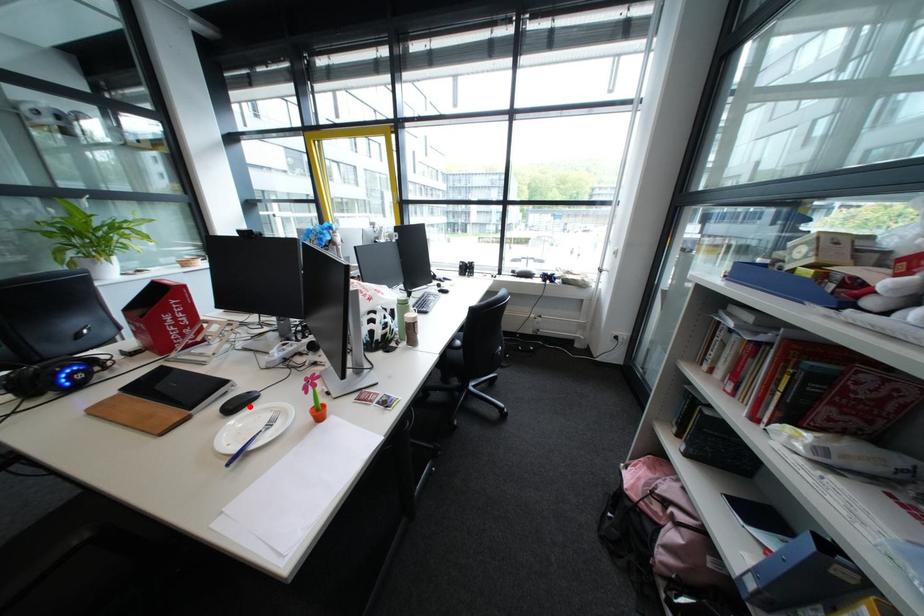
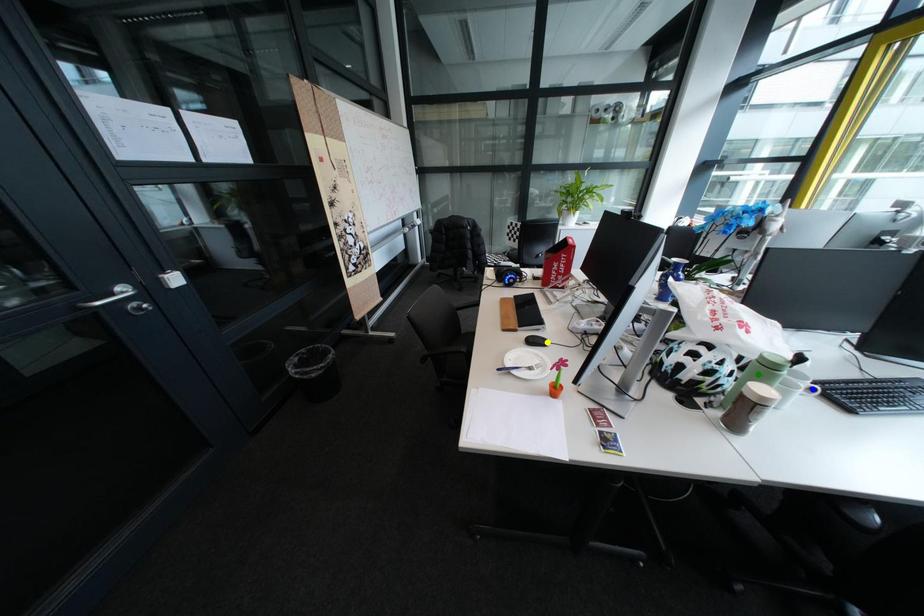
Question: I am providing you with two images of the same scene from different viewpoints. A red point is marked on the first image. You are given multiple points on the second image. Can you choose the point in image 2 that corresponds to the point in image 1?

Choices:
 (A) blue point
 (B) green point
 (C) yellow point

Answer: (C)